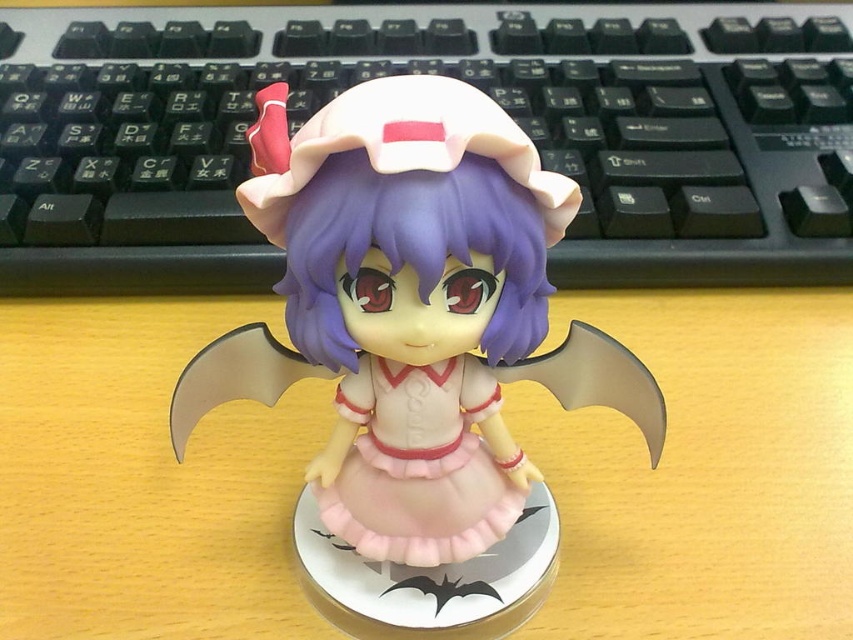
Question: Can you confirm if black plastic keyboard at center is positioned below pink satin dress at center?

Choices:
 (A) yes
 (B) no

Answer: (B)

Question: Which object is positioned farthest from the black plastic keyboard at center?

Choices:
 (A) wooden table at center
 (B) pink satin dress at center
 (C) matte pink plastic figurine at center

Answer: (B)

Question: Among these points, which one is nearest to the camera?

Choices:
 (A) (582, 77)
 (B) (370, 385)
 (C) (785, 400)

Answer: (B)

Question: Which object is the closest to the wooden table at center?

Choices:
 (A) matte pink plastic figurine at center
 (B) pink satin dress at center

Answer: (B)

Question: Does matte pink plastic figurine at center appear on the right side of pink satin dress at center?

Choices:
 (A) yes
 (B) no

Answer: (B)

Question: Can you confirm if wooden table at center is bigger than black plastic keyboard at center?

Choices:
 (A) no
 (B) yes

Answer: (A)